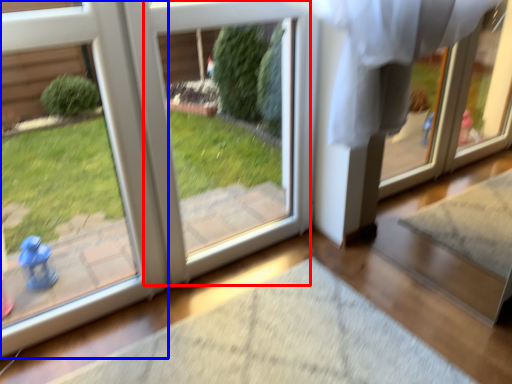
Question: Which object appears farthest to the camera in this image, screen door (highlighted by a red box) or door (highlighted by a blue box)?

Choices:
 (A) screen door
 (B) door

Answer: (A)